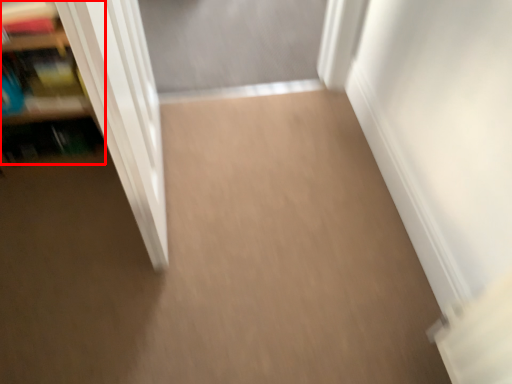
Question: From the image's perspective, considering the relative positions of shelf (annotated by the red box) and door in the image provided, where is shelf (annotated by the red box) located with respect to the staircase?

Choices:
 (A) below
 (B) above

Answer: (B)